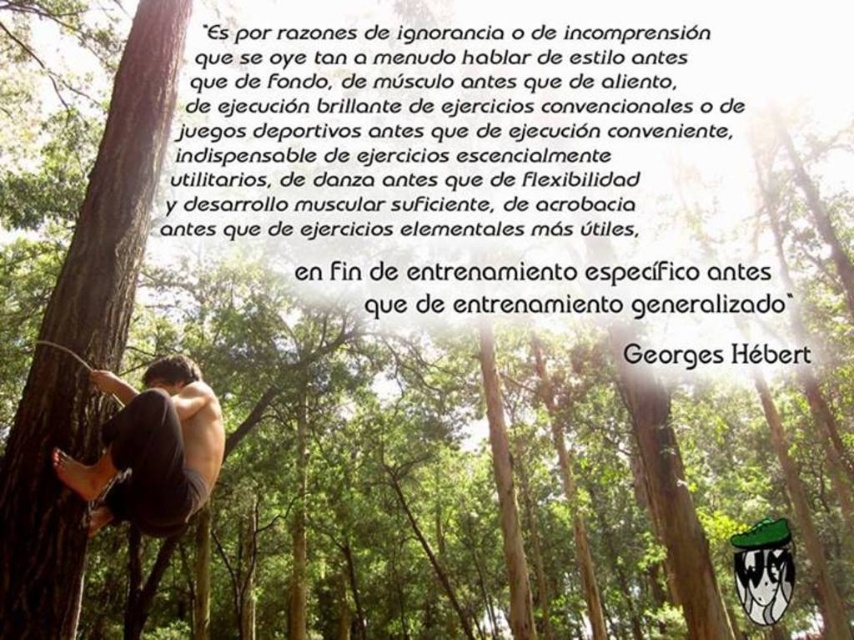
Question: Which point is farther from the camera taking this photo?

Choices:
 (A) (180, 392)
 (B) (114, 340)

Answer: (B)

Question: Which of the following is the closest to the observer?

Choices:
 (A) (110, 384)
 (B) (61, 586)

Answer: (B)

Question: Observing the image, what is the correct spatial positioning of brown rough bark tree at left in reference to dark gray fabric pants at lower left?

Choices:
 (A) right
 (B) left

Answer: (B)

Question: Is brown rough bark tree at left closer to the viewer compared to dark gray fabric pants at lower left?

Choices:
 (A) yes
 (B) no

Answer: (A)

Question: Is brown rough bark tree at left closer to the viewer compared to dark gray fabric pants at lower left?

Choices:
 (A) yes
 (B) no

Answer: (A)